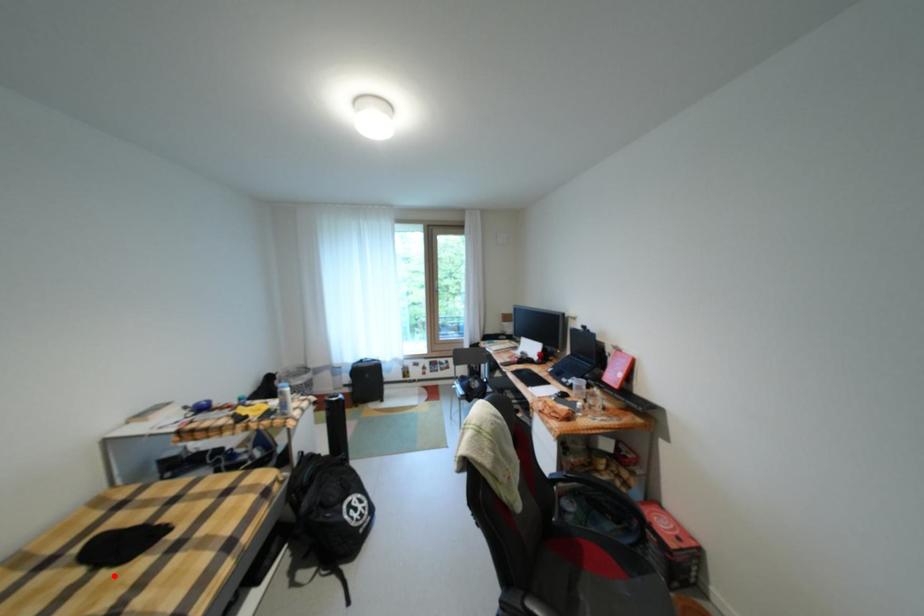
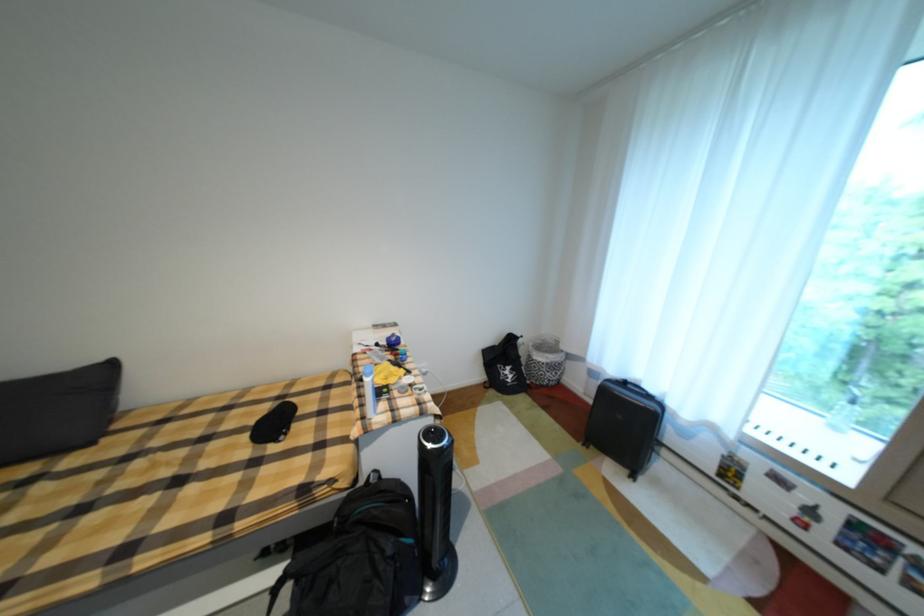
The point at the highlighted location is marked in the first image. Where is the corresponding point in the second image?

(256, 438)